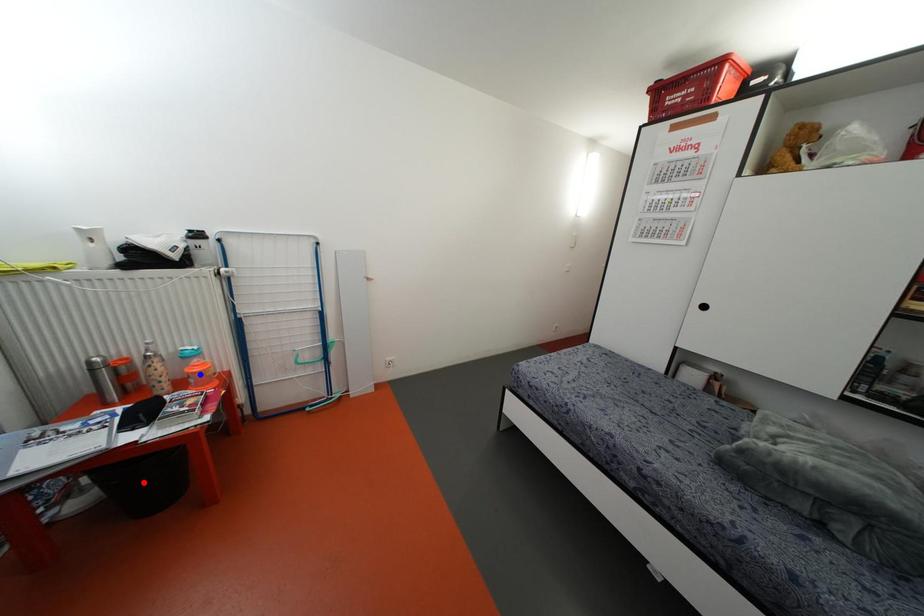
Question: In the image, two points are highlighted. Which point is nearer to the camera? Reply with the corresponding letter.

Choices:
 (A) blue point
 (B) red point

Answer: (B)